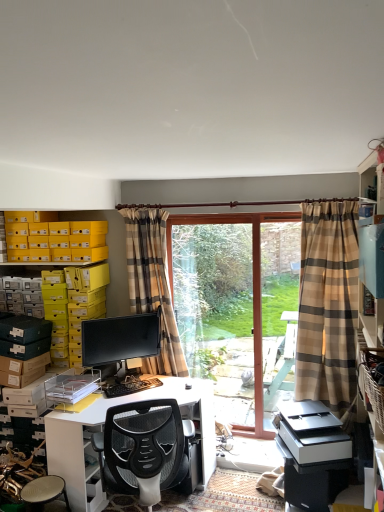
Question: Is matte black monitor at center not close to plaid fabric curtain at right, which is the 2th curtain in left-to-right order?

Choices:
 (A) no
 (B) yes

Answer: (B)

Question: Can you see matte black monitor at center touching plaid fabric curtain at right, placed as the 1th curtain when sorted from front to back?

Choices:
 (A) yes
 (B) no

Answer: (B)

Question: Can we say matte black monitor at center lies outside plaid fabric curtain at right, placed as the 1th curtain when sorted from front to back?

Choices:
 (A) yes
 (B) no

Answer: (A)

Question: Can you confirm if matte black monitor at center is bigger than plaid fabric curtain at right, which is the 2th curtain in left-to-right order?

Choices:
 (A) yes
 (B) no

Answer: (B)

Question: Considering the relative positions of matte black monitor at center and plaid fabric curtain at right, the 2th curtain when ordered from back to front, in the image provided, is matte black monitor at center to the left of plaid fabric curtain at right, the 2th curtain when ordered from back to front, from the viewer's perspective?

Choices:
 (A) no
 (B) yes

Answer: (B)

Question: Looking at their shapes, would you say clear glass door at center is wider or thinner than black plastic keyboard at center?

Choices:
 (A) wide
 (B) thin

Answer: (B)

Question: Is point (198, 254) positioned closer to the camera than point (104, 385)?

Choices:
 (A) farther
 (B) closer

Answer: (A)

Question: Is clear glass door at center inside the boundaries of black plastic keyboard at center, or outside?

Choices:
 (A) inside
 (B) outside

Answer: (B)

Question: From the image's perspective, is clear glass door at center located above or below black plastic keyboard at center?

Choices:
 (A) above
 (B) below

Answer: (A)

Question: From the image's perspective, relative to clear glass screen door at center, is white glossy computer desk at center above or below?

Choices:
 (A) above
 (B) below

Answer: (B)

Question: Looking at their shapes, would you say white glossy computer desk at center is wider or thinner than clear glass screen door at center?

Choices:
 (A) thin
 (B) wide

Answer: (B)

Question: Is white glossy computer desk at center in front of or behind clear glass screen door at center in the image?

Choices:
 (A) front
 (B) behind

Answer: (A)

Question: From a real-world perspective, relative to clear glass screen door at center, is white glossy computer desk at center vertically above or below?

Choices:
 (A) above
 (B) below

Answer: (B)

Question: Considering their positions, is clear glass screen door at center located in front of or behind white glossy computer desk at center?

Choices:
 (A) front
 (B) behind

Answer: (B)

Question: Is clear glass screen door at center situated inside white glossy computer desk at center or outside?

Choices:
 (A) inside
 (B) outside

Answer: (B)